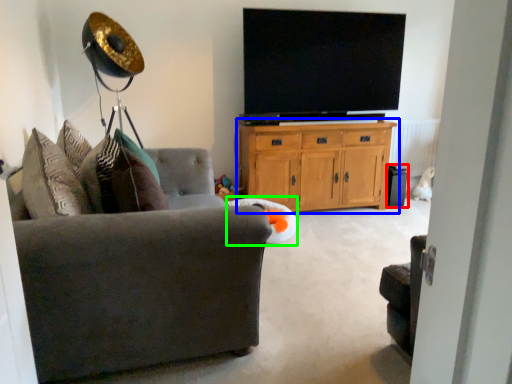
Question: Estimate the real-world distances between objects in this image. Which object is closer to speaker (highlighted by a red box), cabinetry (highlighted by a blue box) or bean bag chair (highlighted by a green box)?

Choices:
 (A) cabinetry
 (B) bean bag chair

Answer: (A)